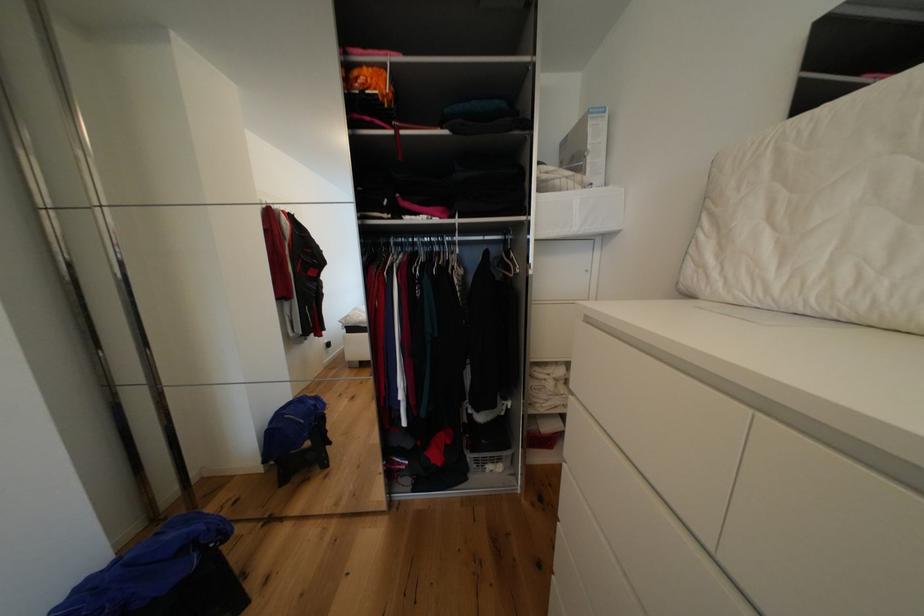
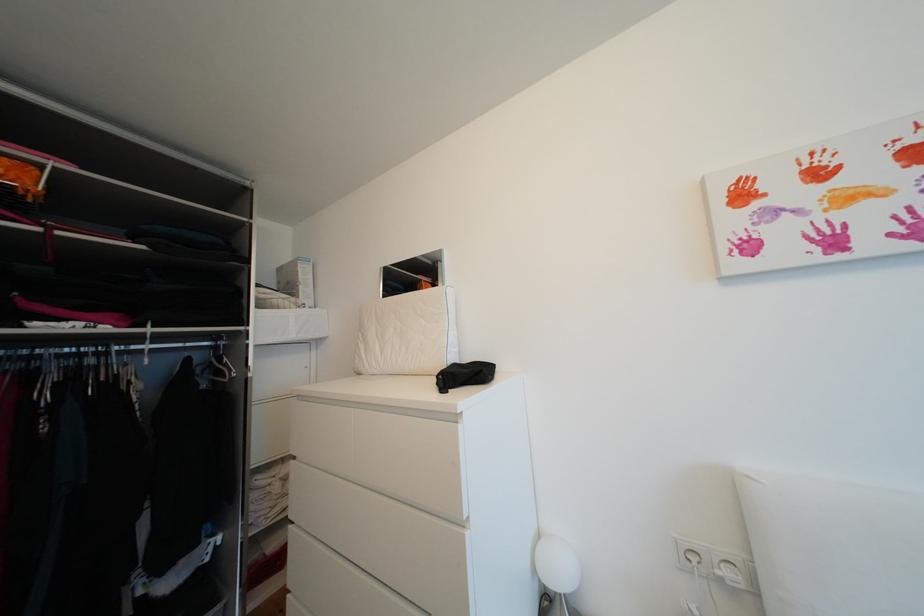
Question: How did the camera likely rotate?

Choices:
 (A) Left
 (B) Right
 (C) Up
 (D) Down

Answer: (B)